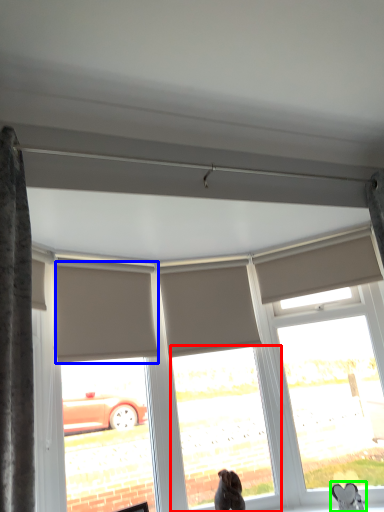
Question: Considering the real-world distances, which object is closest to window (highlighted by a red box)? shutter (highlighted by a blue box) or animal (highlighted by a green box).

Choices:
 (A) shutter
 (B) animal

Answer: (A)